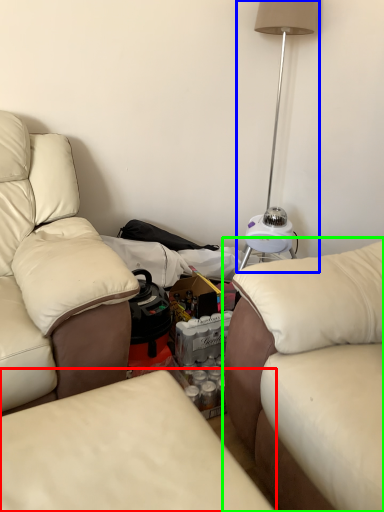
Question: Which object is the closest to the studio couch (highlighted by a red box)? Choose among these: table lamp (highlighted by a blue box) or studio couch (highlighted by a green box).

Choices:
 (A) table lamp
 (B) studio couch

Answer: (B)